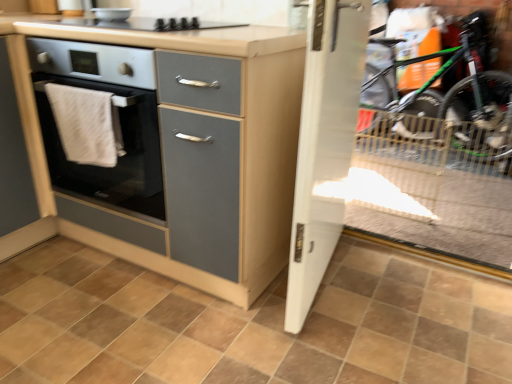
Question: Can we say matte gray cabinet at center lies outside white glossy bowl at upper center?

Choices:
 (A) no
 (B) yes

Answer: (B)

Question: Is matte gray cabinet at center oriented towards white glossy bowl at upper center?

Choices:
 (A) no
 (B) yes

Answer: (A)

Question: Can you confirm if matte gray cabinet at center is shorter than white glossy bowl at upper center?

Choices:
 (A) no
 (B) yes

Answer: (A)

Question: Does matte gray cabinet at center lie in front of white glossy bowl at upper center?

Choices:
 (A) no
 (B) yes

Answer: (B)

Question: From the image's perspective, is matte gray cabinet at center on white glossy bowl at upper center?

Choices:
 (A) yes
 (B) no

Answer: (B)

Question: Is matte gray cabinet at center facing away from white glossy bowl at upper center?

Choices:
 (A) no
 (B) yes

Answer: (A)

Question: Is white cloth at left outside of matte gray cabinet at left?

Choices:
 (A) yes
 (B) no

Answer: (A)

Question: Is white cloth at left wider than matte gray cabinet at left?

Choices:
 (A) yes
 (B) no

Answer: (B)

Question: Is white cloth at left shorter than matte gray cabinet at left?

Choices:
 (A) yes
 (B) no

Answer: (A)

Question: Considering the relative positions of white cloth at left and matte gray cabinet at left in the image provided, is white cloth at left to the right of matte gray cabinet at left from the viewer's perspective?

Choices:
 (A) yes
 (B) no

Answer: (A)

Question: Is white cloth at left far from matte gray cabinet at left?

Choices:
 (A) no
 (B) yes

Answer: (A)

Question: Considering the relative positions of white cloth at left and matte gray cabinet at left in the image provided, is white cloth at left to the left of matte gray cabinet at left from the viewer's perspective?

Choices:
 (A) no
 (B) yes

Answer: (A)

Question: Is matte gray cabinet at left completely or partially outside of matte gray cabinet at center?

Choices:
 (A) yes
 (B) no

Answer: (A)